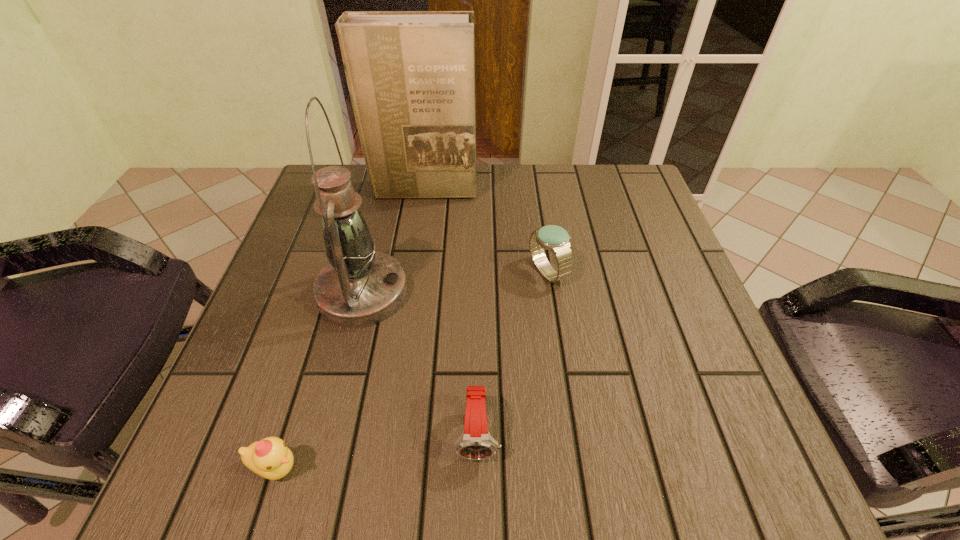
This screenshot has height=540, width=960. What are the coordinates of `phonebook` in the screenshot? It's located at (411, 74).

This screenshot has height=540, width=960. I want to click on oil lamp, so click(359, 287).

Identify the location of the rightmost object. This screenshot has width=960, height=540. (555, 238).

The width and height of the screenshot is (960, 540). I want to click on the farther watch, so click(x=555, y=238).

The width and height of the screenshot is (960, 540). Identify the location of the nearer watch. (475, 443).

You are a GUI agent. You are given a task and a screenshot of the screen. Output one action in this format:
    pyautogui.click(x=<x>, y=<y>)
    Task: Click on the duckling
    This screenshot has width=960, height=540.
    Given the screenshot: What is the action you would take?
    pyautogui.click(x=270, y=458)

The image size is (960, 540). I want to click on free space located on the cover of the phonebook, so click(407, 298).

I want to click on vacant space positioned on the front of the oil lamp, so click(x=340, y=385).

Where is `free location located on the right of the right watch`? free location located on the right of the right watch is located at coordinates (598, 272).

Locate an element on the screen. This screenshot has width=960, height=540. free space located on the front-facing side of the duckling is located at coordinates (444, 468).